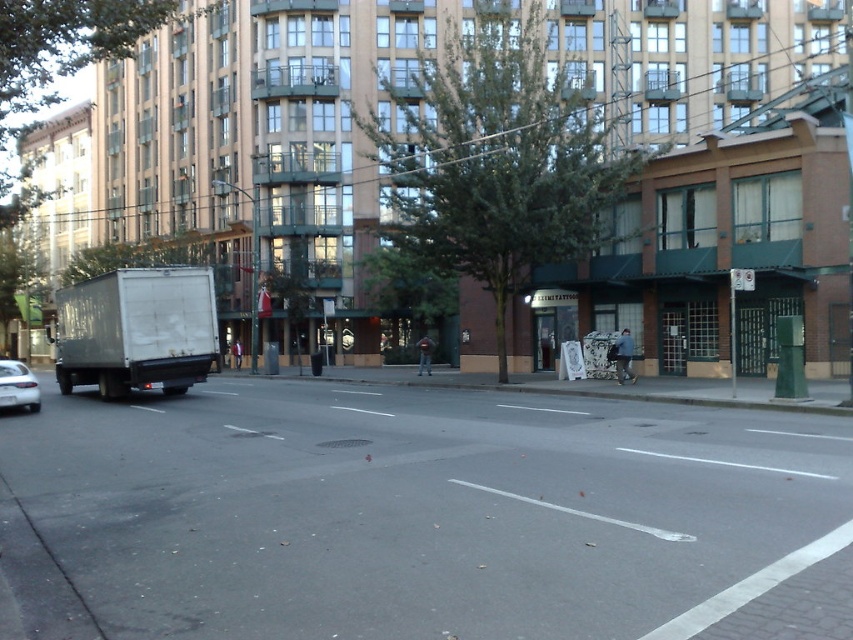
You are a pedestrian standing on the sidewalk in the scene. You want to cross the street to reach the large multi story building with beige facade in the background. The white matte truck at left is blocking your path. Can you safely walk around the truck to reach the sidewalk on the other side?

The white matte truck at left is 24.23 meters from the viewer. Since it is parked on the left side of the frame facing away, there might be enough space to walk around it safely to reach the sidewalk on the other side, but the exact distance isn generated in the question.

You are a pedestrian standing at the center of the street. You see a white matte truck at left and a white matte sedan at lower left. Which vehicle is closer to your left side?

The white matte sedan at lower left is closer to your left side because it is positioned to the left of the white matte truck at left.